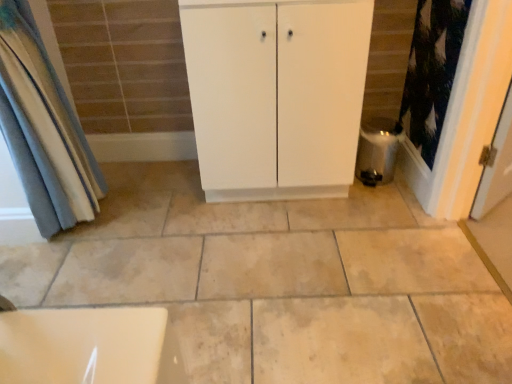
Where is `free space behind blue fabric curtain at left`? This screenshot has width=512, height=384. free space behind blue fabric curtain at left is located at coordinates (130, 182).